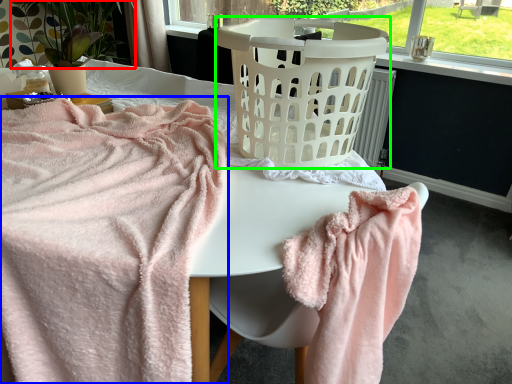
Question: Based on their relative distances, which object is farther from plant (highlighted by a red box)? Choose from towel (highlighted by a blue box) and basket container (highlighted by a green box).

Choices:
 (A) towel
 (B) basket container

Answer: (B)